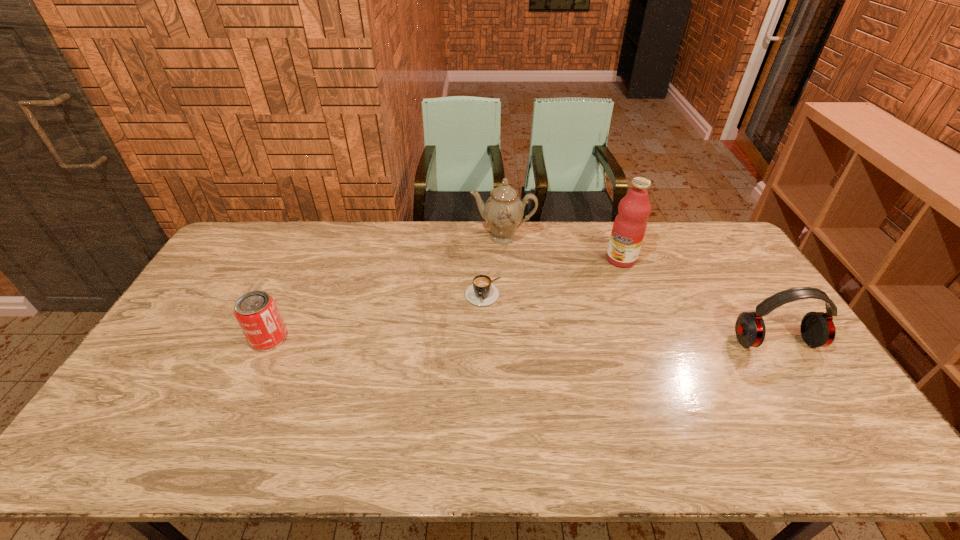
At what (x,y) coordinates should I click in order to perform the action: click on object that is the third closest to the second tallest object. Please return your answer as a coordinate pair (x, y). Looking at the image, I should click on (256, 312).

Identify the location of free space that satisfies the following two spatial constraints: 1. on the back side of the can; 2. on the right side of the chinaware. (316, 237).